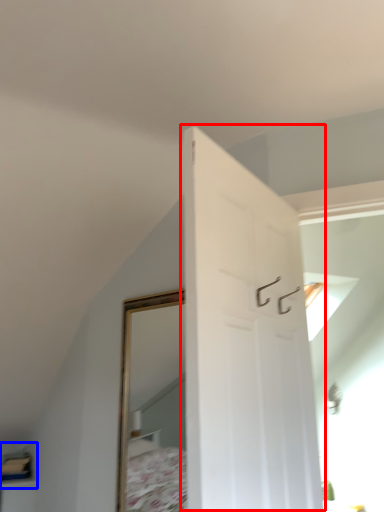
Question: Which object is further to the camera taking this photo, door (highlighted by a red box) or shelf (highlighted by a blue box)?

Choices:
 (A) door
 (B) shelf

Answer: (B)